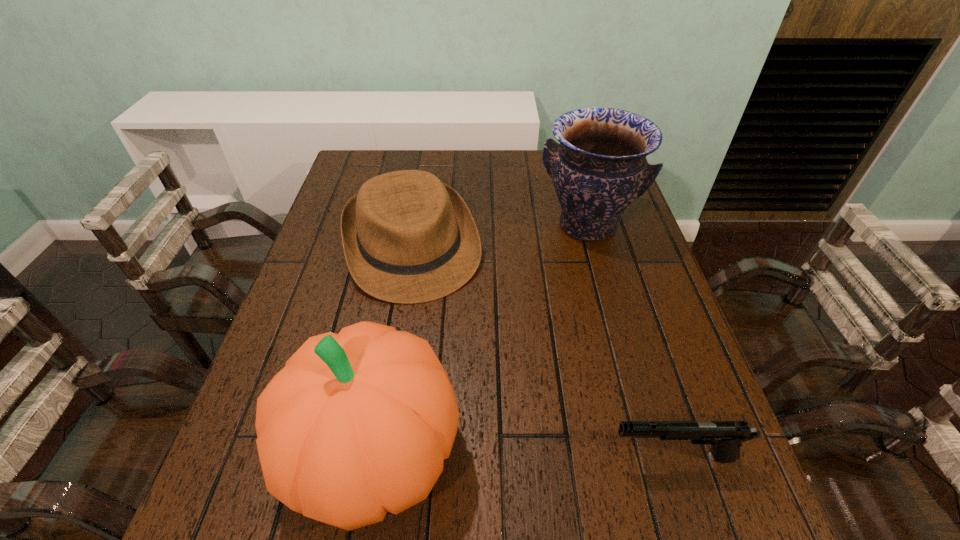
This screenshot has width=960, height=540. What are the coordinates of `free spot on the desktop that is between the pumpkin and the gun and is positioned on the front-facing side of the fedora` in the screenshot? It's located at (479, 454).

The height and width of the screenshot is (540, 960). I want to click on vacant spot on the desktop that is between the pumpkin and the shortest object and is positioned on the front handle of the pottery, so click(x=511, y=454).